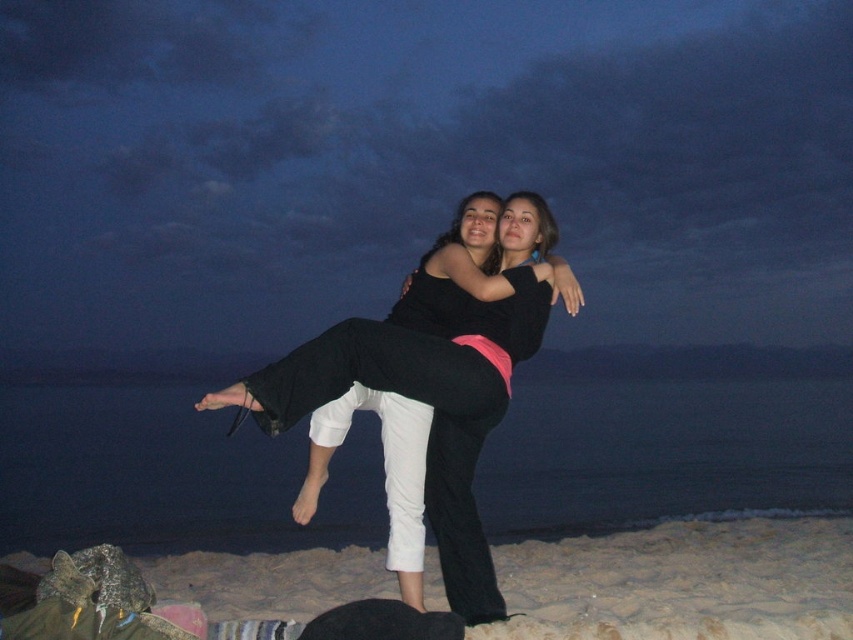
You are a photographer planning to capture a wide shot of the scene. Given that the sandy at lower center is wider than the black matte pants at center, which object should you focus on to ensure both subjects are fully visible in the frame?

Since the sandy at lower center is wider than the black matte pants at center, focusing on the sandy at lower center will ensure both objects are fully visible in the frame as it provides a broader area to accommodate the subjects.

You are a photographer trying to capture the scene of the two people on the beach. You notice the sandy at lower center and the black matte pants at center. Which object in the image takes up more space?

The sandy at lower center takes up more space than the black matte pants at center because it is larger in size according to the description.